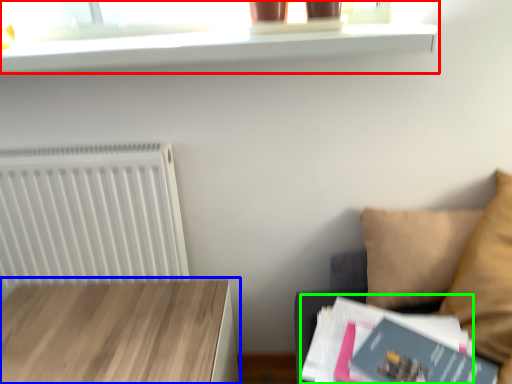
Question: Based on their relative distances, which object is farther from shelf (highlighted by a red box)? Choose from table (highlighted by a blue box) and paperback book (highlighted by a green box).

Choices:
 (A) table
 (B) paperback book

Answer: (B)